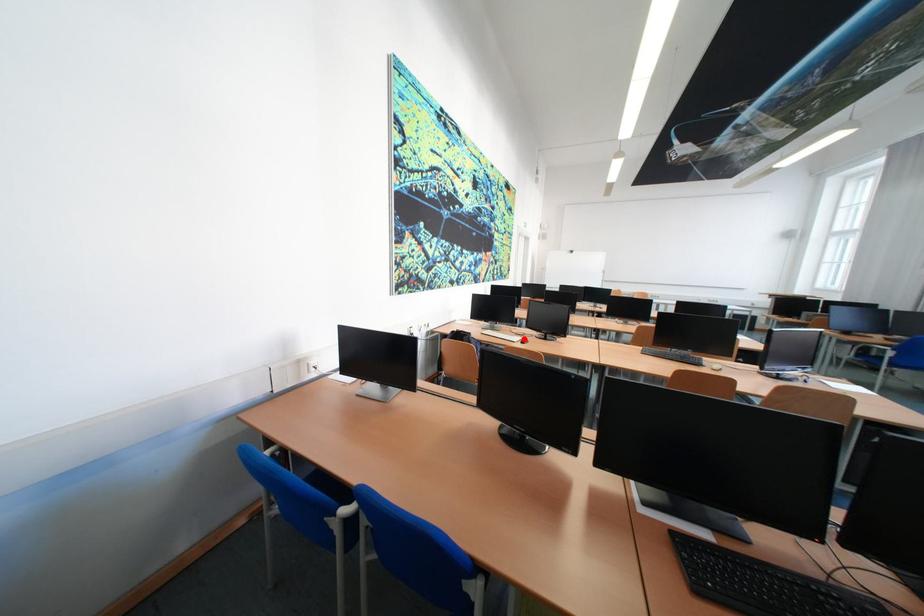
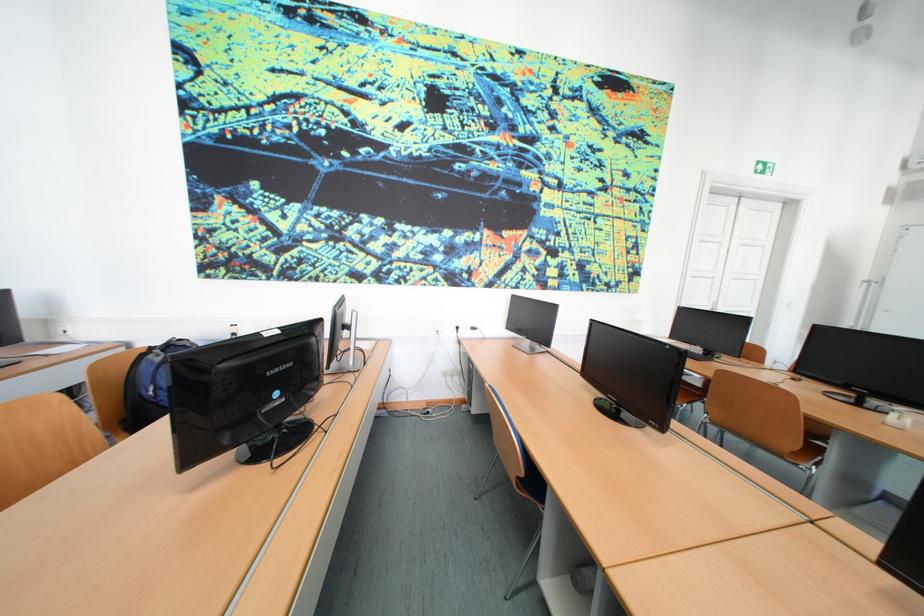
Question: I am providing you with two images of the same scene from different viewpoints. A red point is marked on the first image. Is the red point's position out of view in image 2?

Choices:
 (A) Yes
 (B) No

Answer: (A)